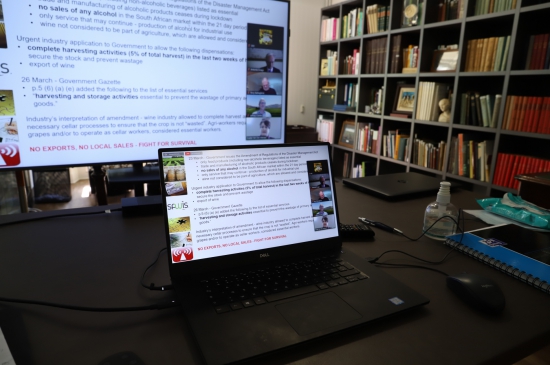
What are the coordinates of `mouse` in the screenshot? It's located at (474, 285).